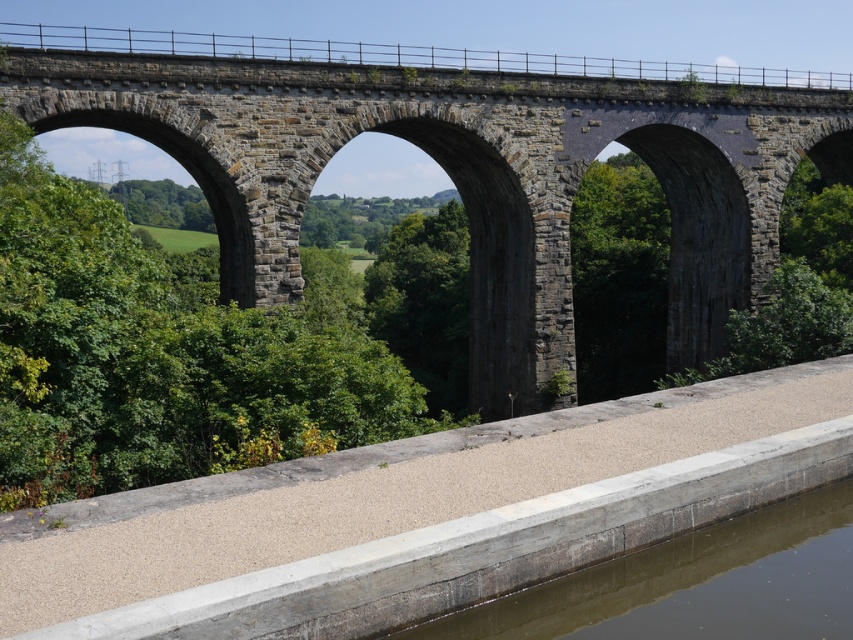
You are a photographer planning to capture the dark gray stone bridge at center and the brown concrete river at lower center in a single shot. Given that the camera can only focus on one object clearly, which object should you prioritize to ensure it fills more of the frame?

The dark gray stone bridge at center should be prioritized because it has a larger size compared to the brown concrete river at lower center, ensuring it fills more of the frame.

You are a delivery truck driver who needs to cross the dark gray stone bridge at center. The truck is 3 meters wide. The brown concrete river at lower center is under the bridge. Can the truck safely pass through the bridge without hitting the sides?

The dark gray stone bridge at center is wider than the brown concrete river at lower center. Since the bridge is wider than the river, the truck can safely pass through the bridge as its width accommodates the truck.